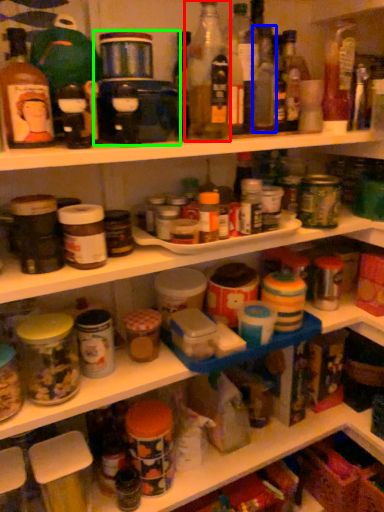
Question: Which object is the farthest from bottle (highlighted by a red box)? Choose among these: bottle (highlighted by a blue box) or appliance (highlighted by a green box).

Choices:
 (A) bottle
 (B) appliance

Answer: (B)